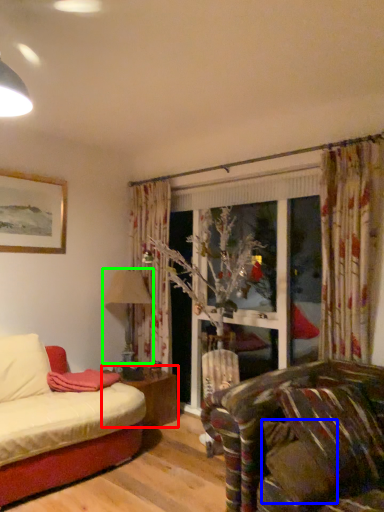
Question: Which object is the closest to the table (highlighted by a red box)? Choose among these: pillow (highlighted by a blue box) or lamp (highlighted by a green box).

Choices:
 (A) pillow
 (B) lamp

Answer: (B)